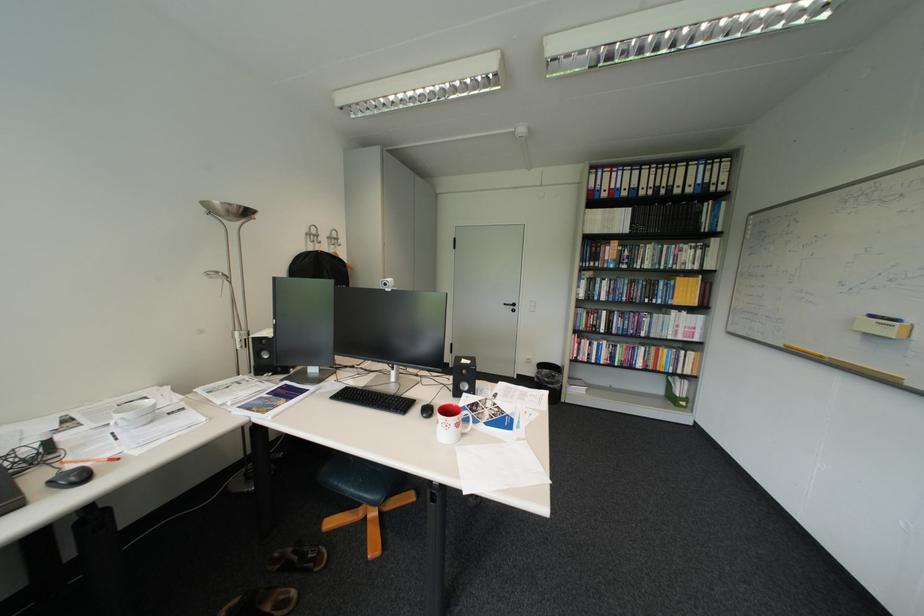
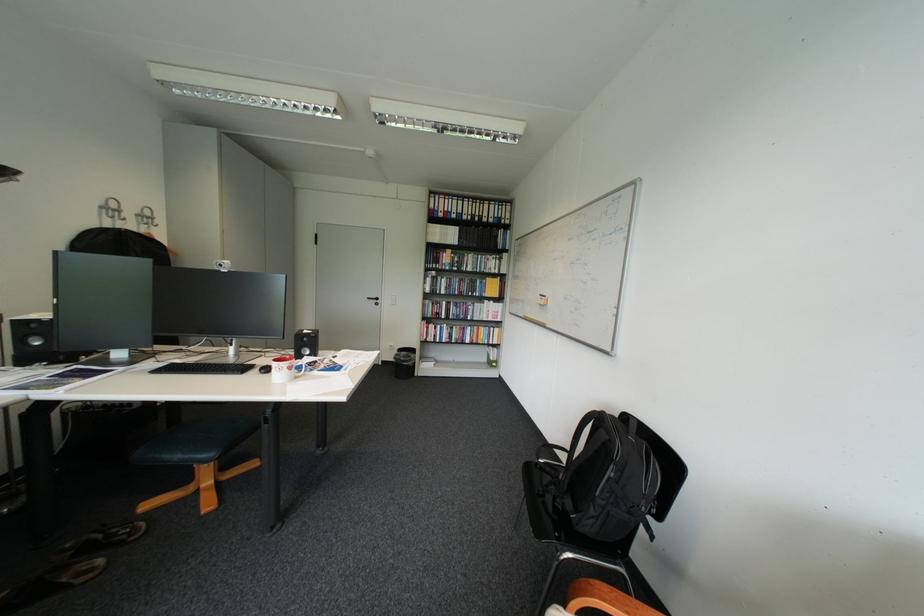
The point at [673,246] is marked in the first image. Where is the corresponding point in the second image?

(489, 257)